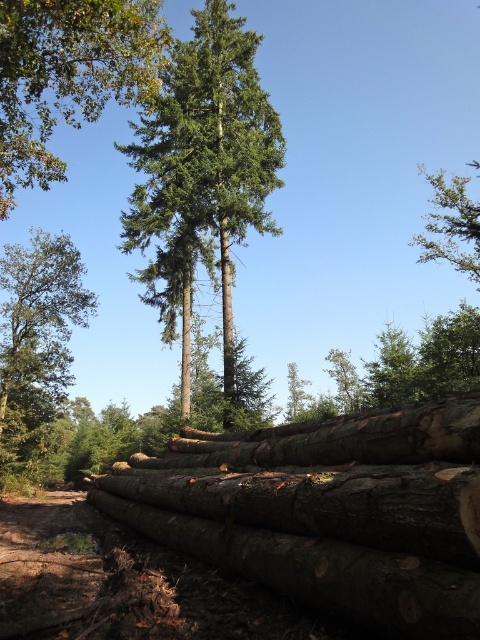
Question: Considering the relative positions of green textured tree at center and green matte tree at upper right in the image provided, where is green textured tree at center located with respect to green matte tree at upper right?

Choices:
 (A) left
 (B) right

Answer: (A)

Question: Which object is closer to the camera taking this photo?

Choices:
 (A) green textured tree at center
 (B) green matte tree at upper right

Answer: (A)

Question: Which is farther from the green matte tree at upper right?

Choices:
 (A) green matte tree at upper left
 (B) green matte tree at left

Answer: (B)

Question: Is green textured tree at center in front of green matte tree at upper right?

Choices:
 (A) no
 (B) yes

Answer: (B)

Question: Where is green matte tree at left located in relation to green matte tree at upper right in the image?

Choices:
 (A) right
 (B) left

Answer: (B)

Question: Which object is closer to the camera taking this photo?

Choices:
 (A) brown rough wood at lower center
 (B) green matte tree at left
 (C) green textured tree at center
 (D) green matte tree at upper left

Answer: (A)